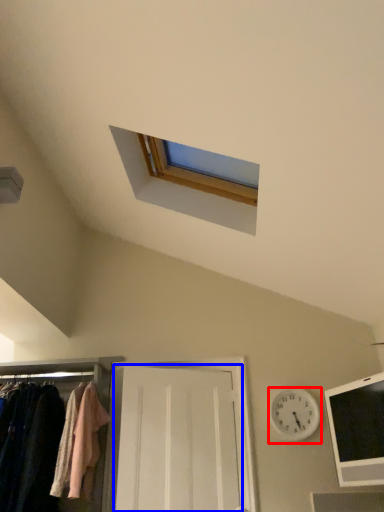
Question: Which point is closer to the camera, clock (highlighted by a red box) or door (highlighted by a blue box)?

Choices:
 (A) clock
 (B) door

Answer: (B)